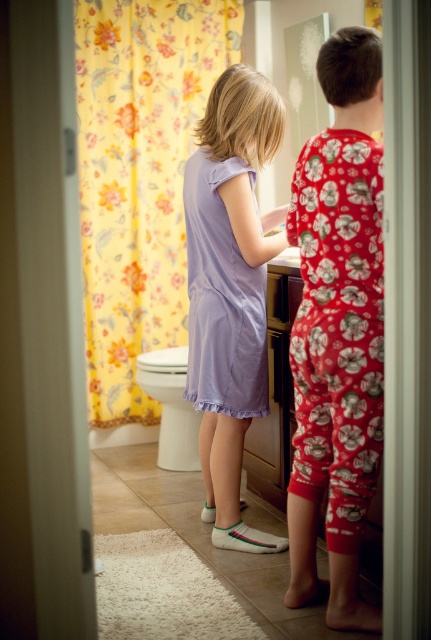
Can you confirm if lavender satin dress at center is thinner than white glossy toilet bowl at lower left?

In fact, lavender satin dress at center might be wider than white glossy toilet bowl at lower left.

Which is in front, point (212, 317) or point (174, 365)?

Point (212, 317) is in front.

Locate an element on the screen. lavender satin dress at center is located at coordinates (221, 300).

Between point (364, 152) and point (236, 419), which one is positioned behind?

Point (236, 419)

Where is `matte purple dress at center`? The width and height of the screenshot is (431, 640). matte purple dress at center is located at coordinates (337, 328).

Is matte purple dress at center below lavender satin dress at center?

Yes.

Does matte purple dress at center have a greater width compared to lavender satin dress at center?

In fact, matte purple dress at center might be narrower than lavender satin dress at center.

What do you see at coordinates (337, 328) in the screenshot? I see `matte purple dress at center` at bounding box center [337, 328].

You are a GUI agent. You are given a task and a screenshot of the screen. Output one action in this format:
    pyautogui.click(x=<x>, y=<y>)
    Task: Click on the matte purple dress at center
    
    Given the screenshot: What is the action you would take?
    pos(337,328)